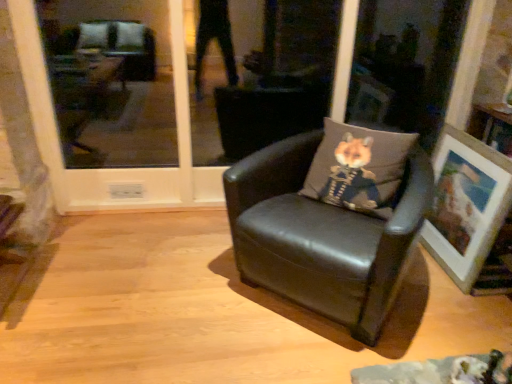
Question: Are wooden picture frame at right and gray fabric pillow with fox print at center far apart?

Choices:
 (A) yes
 (B) no

Answer: (B)

Question: Does wooden picture frame at right appear on the right side of gray fabric pillow with fox print at center?

Choices:
 (A) no
 (B) yes

Answer: (B)

Question: Is wooden picture frame at right oriented away from gray fabric pillow with fox print at center?

Choices:
 (A) no
 (B) yes

Answer: (A)

Question: Is wooden picture frame at right further to the viewer compared to gray fabric pillow with fox print at center?

Choices:
 (A) yes
 (B) no

Answer: (A)

Question: From the image's perspective, is wooden picture frame at right over gray fabric pillow with fox print at center?

Choices:
 (A) no
 (B) yes

Answer: (A)

Question: Is wooden picture frame at right taller or shorter than transparent glass door at center?

Choices:
 (A) short
 (B) tall

Answer: (A)

Question: From the image's perspective, is wooden picture frame at right located above or below transparent glass door at center?

Choices:
 (A) above
 (B) below

Answer: (B)

Question: Which is correct: wooden picture frame at right is inside transparent glass door at center, or outside of it?

Choices:
 (A) inside
 (B) outside

Answer: (B)

Question: In terms of width, does wooden picture frame at right look wider or thinner when compared to transparent glass door at center?

Choices:
 (A) thin
 (B) wide

Answer: (A)

Question: From the image's perspective, is black leather chair at center located above or below transparent glass door at center?

Choices:
 (A) above
 (B) below

Answer: (B)

Question: In the image, is black leather chair at center positioned in front of or behind transparent glass door at center?

Choices:
 (A) front
 (B) behind

Answer: (A)

Question: Visually, is black leather chair at center positioned to the left or to the right of transparent glass door at center?

Choices:
 (A) left
 (B) right

Answer: (B)

Question: Is point (254, 283) positioned closer to the camera than point (194, 187)?

Choices:
 (A) closer
 (B) farther

Answer: (A)

Question: Is transparent glass door at center wider or thinner than black leather chair at center?

Choices:
 (A) thin
 (B) wide

Answer: (A)

Question: From the image's perspective, is transparent glass door at center positioned above or below black leather chair at center?

Choices:
 (A) above
 (B) below

Answer: (A)